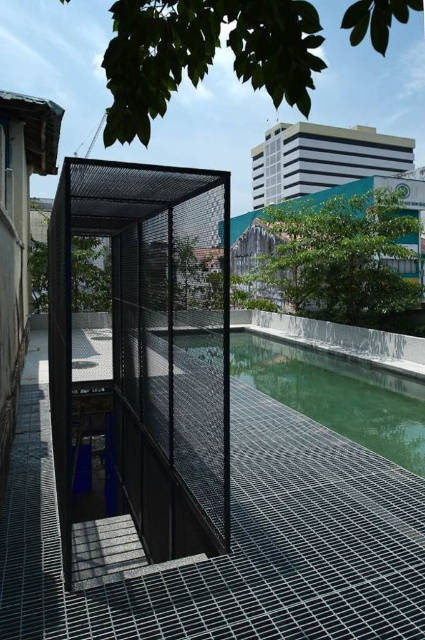
In the scene shown: You are standing in the urban setting shown in the image. You need to locate the black mesh cage at center. Where would you look based on the coordinates provided?

The black mesh cage at center is located at the 2D coordinates point (141, 358).

You are standing in the urban setting and want to walk from the traditional building on the left to the modern installation on the right. Which object, the black mesh cage at center or the green glass water at center, will you encounter first?

The black mesh cage at center is positioned on the left side of green glass water at center, so you will encounter the black mesh cage at center first on your path from the traditional building on the left to the modern installation on the right.

You are standing in front of the metal cage structure at the pool. You want to take a photo of the point at coordinates (119, 472). Is the point within the camera frame?

The point at coordinates (119, 472) is 7.84 meters away from the camera. Assuming the camera has a standard field of view, this distance is likely within the frame unless the camera is zoomed in significantly. However, without specific lens details, it is hard to confirm definitively.